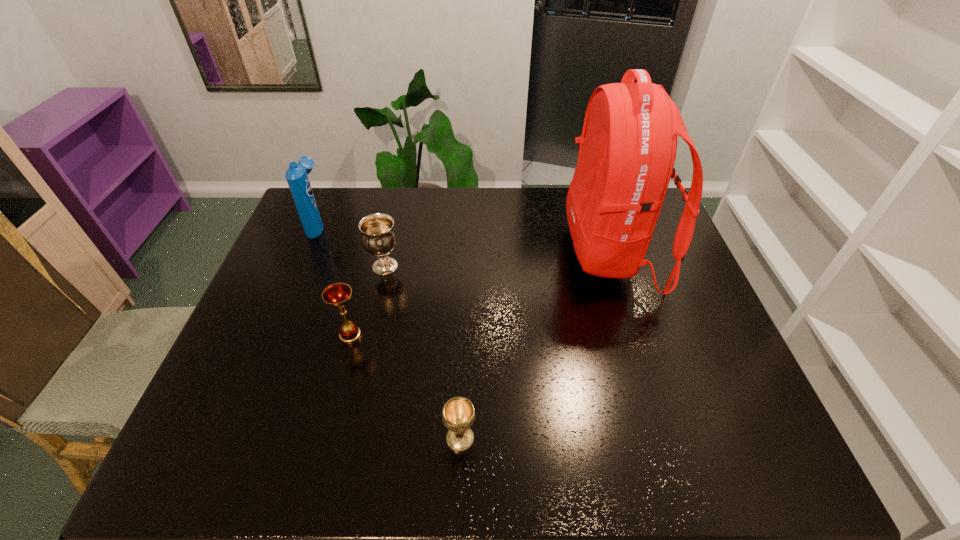
The height and width of the screenshot is (540, 960). Identify the location of vacant space located 0.360m on the main compartment of the backpack. (451, 253).

The height and width of the screenshot is (540, 960). Identify the location of vacant area situated 0.170m on the right of the leftmost object. (376, 225).

Where is `free location located on the left of the farthest chalice`? This screenshot has width=960, height=540. free location located on the left of the farthest chalice is located at coordinates (316, 267).

Where is `vacant space situated 0.130m on the front of the second nearest object`? vacant space situated 0.130m on the front of the second nearest object is located at coordinates (336, 390).

This screenshot has width=960, height=540. In order to click on vacant space situated on the back of the nearest chalice in this screenshot , I will do `click(464, 319)`.

At what (x,y) coordinates should I click in order to perform the action: click on backpack that is at the far edge. Please return your answer as a coordinate pair (x, y). The image size is (960, 540). Looking at the image, I should click on (628, 145).

Where is `shampoo present at the far edge`? This screenshot has width=960, height=540. shampoo present at the far edge is located at coordinates (296, 175).

Identify the location of object that is positioned at the near edge. (458, 415).

Identify the location of object located in the left edge section of the desktop. Image resolution: width=960 pixels, height=540 pixels. (296, 175).

This screenshot has height=540, width=960. In order to click on object positioned at the right edge in this screenshot , I will do `click(628, 145)`.